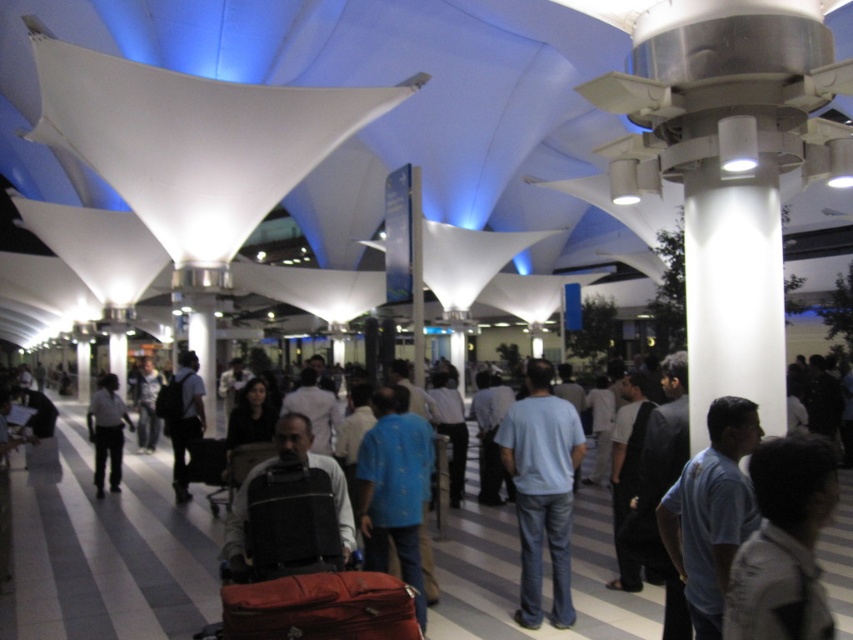
Question: Which point is closer to the camera?

Choices:
 (A) (328, 561)
 (B) (776, 589)
 (C) (309, 476)

Answer: (B)

Question: Is light gray fabric shirt at center closer to camera compared to dark gray fabric bag at center?

Choices:
 (A) yes
 (B) no

Answer: (A)

Question: Considering the real-world distances, which object is closest to the black leather suitcase at center?

Choices:
 (A) light blue cotton shirt at center
 (B) dark blue backpack at center
 (C) light gray fabric shirt at center

Answer: (C)

Question: Does light gray fabric shirt at center have a greater width compared to black leather suitcase at center?

Choices:
 (A) no
 (B) yes

Answer: (A)

Question: Is light blue cotton shirt at center smaller than black leather suitcase at center?

Choices:
 (A) no
 (B) yes

Answer: (B)

Question: Which object appears farthest from the camera in this image?

Choices:
 (A) light blue cotton shirt at center
 (B) light blue t-shirt at center
 (C) dark blue backpack at center

Answer: (C)